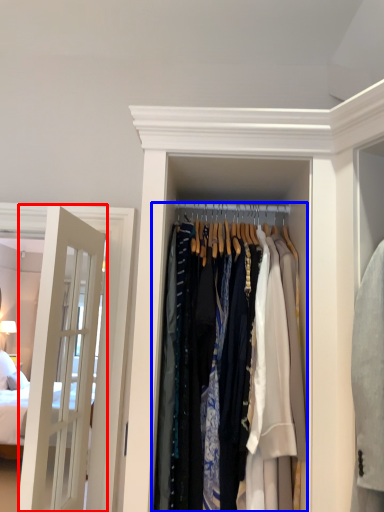
Question: Which object appears farthest to the camera in this image, door (highlighted by a red box) or closet (highlighted by a blue box)?

Choices:
 (A) door
 (B) closet

Answer: (A)